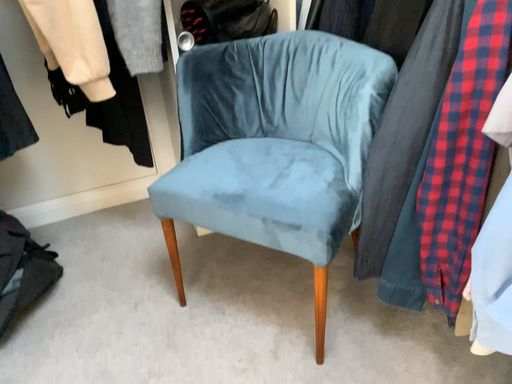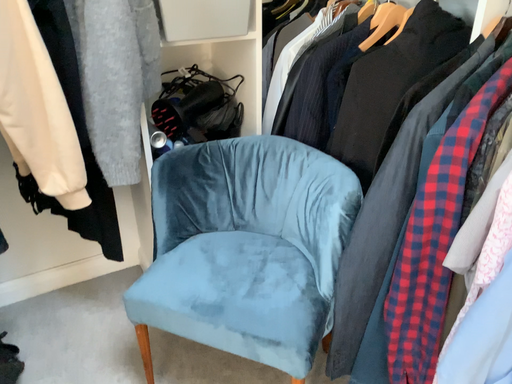
Question: How did the camera likely rotate when shooting the video?

Choices:
 (A) rotated right
 (B) rotated left

Answer: (A)